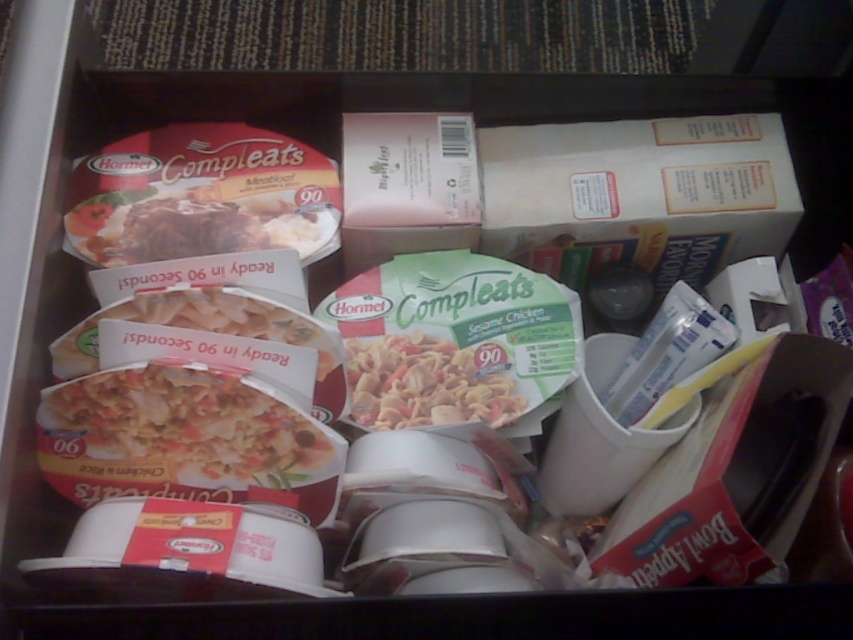
Can you confirm if white matte compleats at center is bigger than matte plastic compleats meal at center?

Indeed, white matte compleats at center has a larger size compared to matte plastic compleats meal at center.

Which of these two, white matte compleats at center or matte plastic compleats meal at center, stands shorter?

matte plastic compleats meal at center

I want to click on white matte compleats at center, so click(177, 432).

Does white matte compleats at center appear under green matte compleats bowl at center?

Indeed, white matte compleats at center is positioned under green matte compleats bowl at center.

Where is `white matte compleats at center`? white matte compleats at center is located at coordinates (177, 432).

Is matte plastic compleats meal at center below green matte compleats bowl at center?

No.

Who is more distant from viewer, (x=132, y=218) or (x=444, y=397)?

The point (x=132, y=218) is more distant.

Describe the element at coordinates (196, 225) in the screenshot. This screenshot has height=640, width=853. I see `matte plastic compleats meal at center` at that location.

Locate an element on the screen. Image resolution: width=853 pixels, height=640 pixels. matte plastic compleats meal at center is located at coordinates (196, 225).